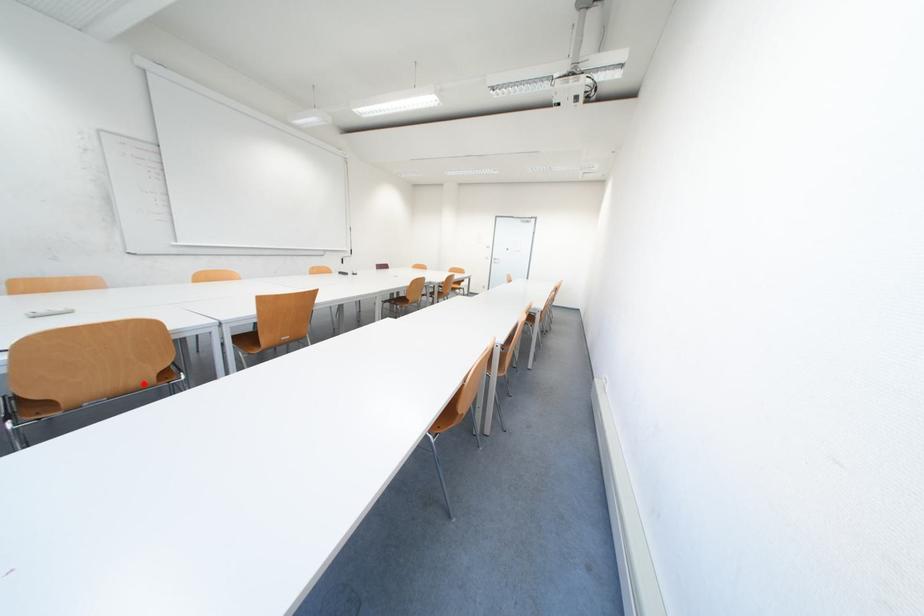
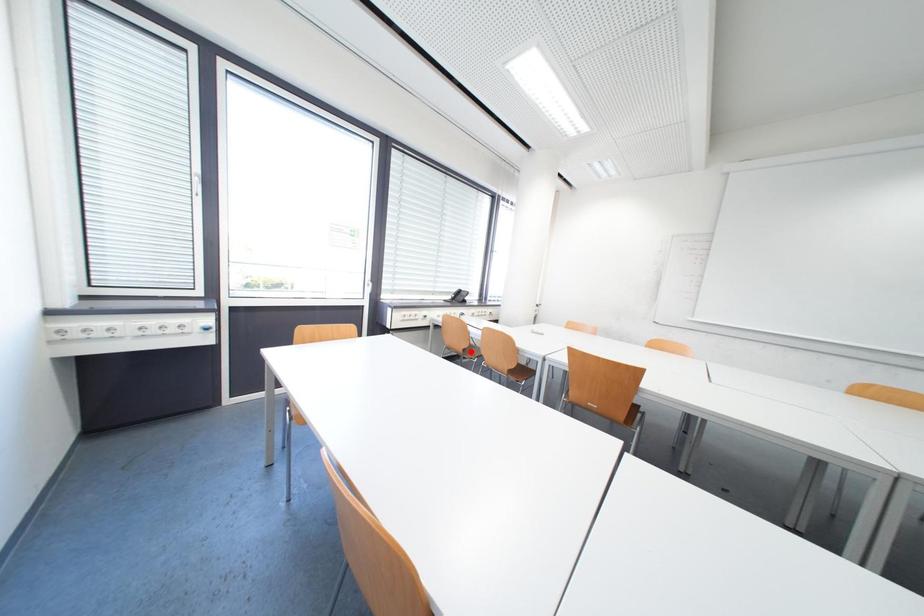
I am providing you with two images of the same scene from different viewpoints. A red point is marked on the first image and another point is marked on the second image. Is the marked point in image1 the same physical position as the marked point in image2?

No